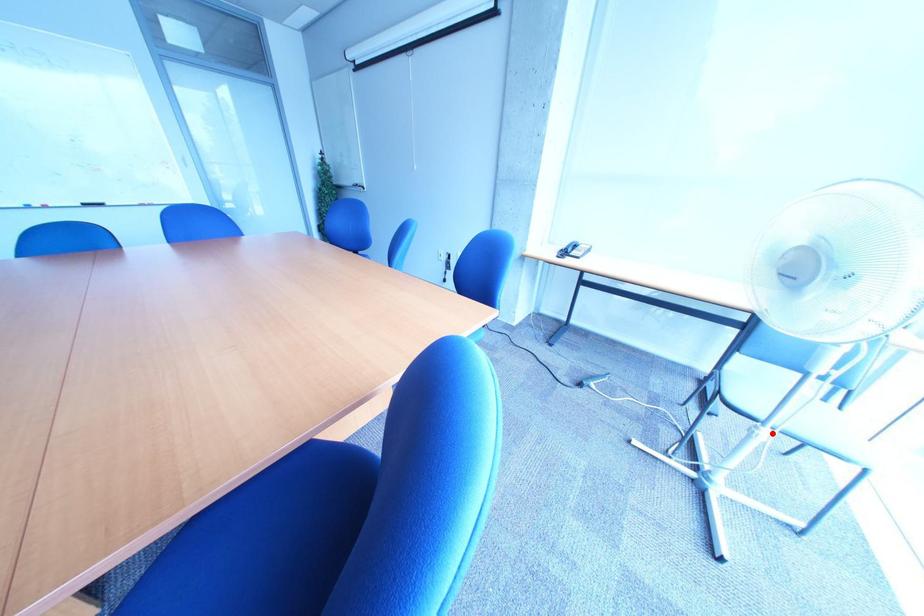
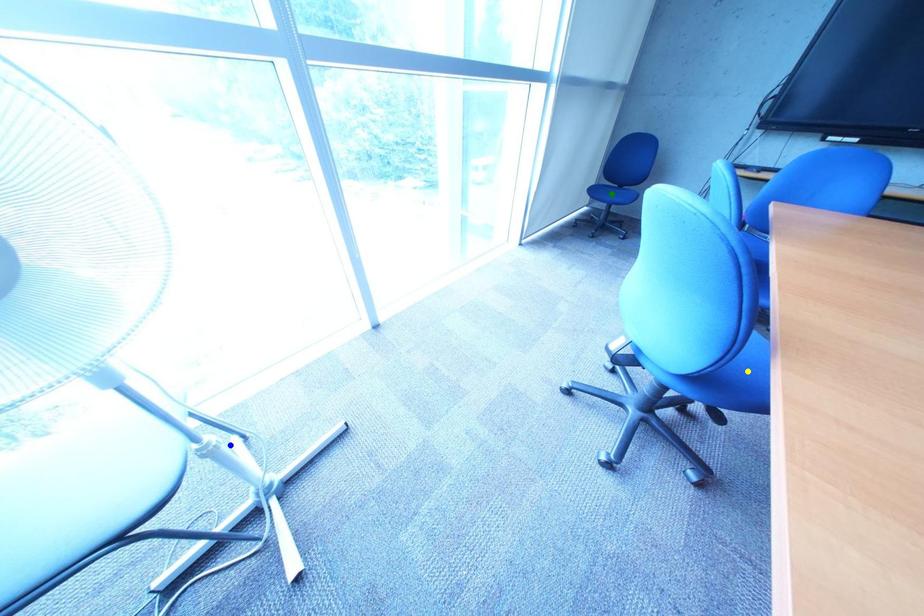
Question: I am providing you with two images of the same scene from different viewpoints. A red point is marked on the first image. You are given multiple points on the second image. Which point in image 2 is actually the same real-world point as the red point in image 1?

Choices:
 (A) blue point
 (B) yellow point
 (C) green point

Answer: (A)